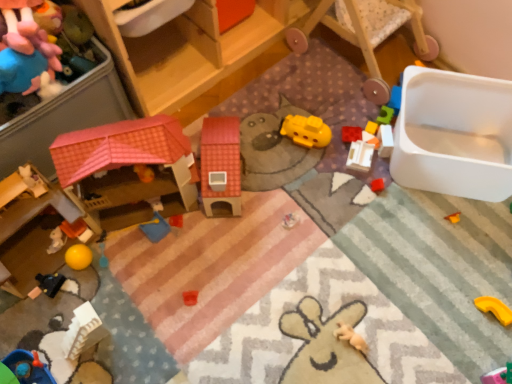
The image size is (512, 384). Find the location of `vacant space behind yellow rubber toy at lower right, positioned as the 11th toy in left-to-right order`. vacant space behind yellow rubber toy at lower right, positioned as the 11th toy in left-to-right order is located at coordinates (470, 255).